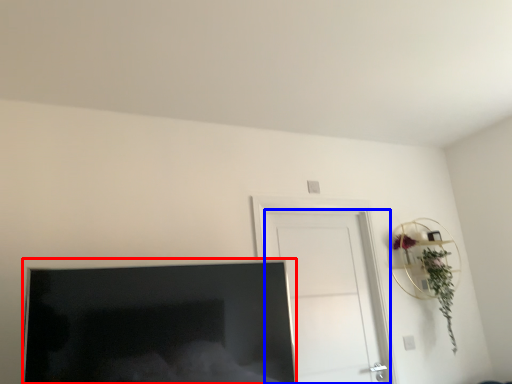
Question: Which object is further to the camera taking this photo, television (highlighted by a red box) or door (highlighted by a blue box)?

Choices:
 (A) television
 (B) door

Answer: (B)